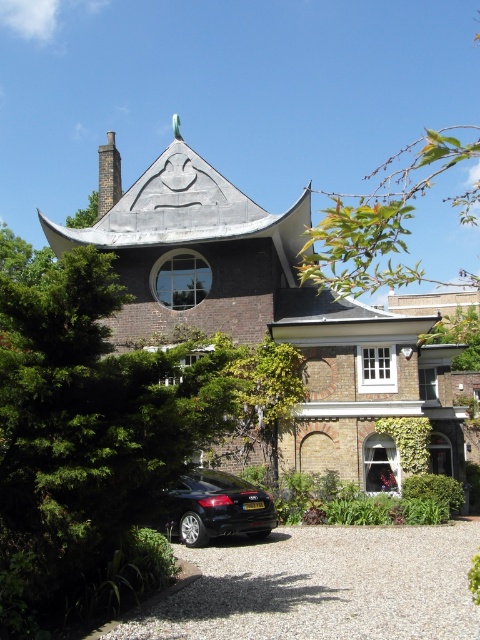
Question: Is gravel driveway at lower center smaller than dark gray stone chimney at upper left?

Choices:
 (A) yes
 (B) no

Answer: (A)

Question: Can you confirm if gravel driveway at lower center is smaller than dark gray stone chimney at upper left?

Choices:
 (A) yes
 (B) no

Answer: (A)

Question: Which of the following is the closest to the observer?

Choices:
 (A) (112, 147)
 (B) (425, 577)
 (C) (192, 499)

Answer: (B)

Question: Which of the following is the farthest from the observer?

Choices:
 (A) (229, 532)
 (B) (120, 161)
 (C) (226, 632)

Answer: (B)

Question: Which object is the farthest from the gravel driveway at lower center?

Choices:
 (A) dark gray stone chimney at upper left
 (B) black matte car at lower center

Answer: (A)

Question: From the image, what is the correct spatial relationship of gravel driveway at lower center in relation to black matte car at lower center?

Choices:
 (A) right
 (B) left

Answer: (A)